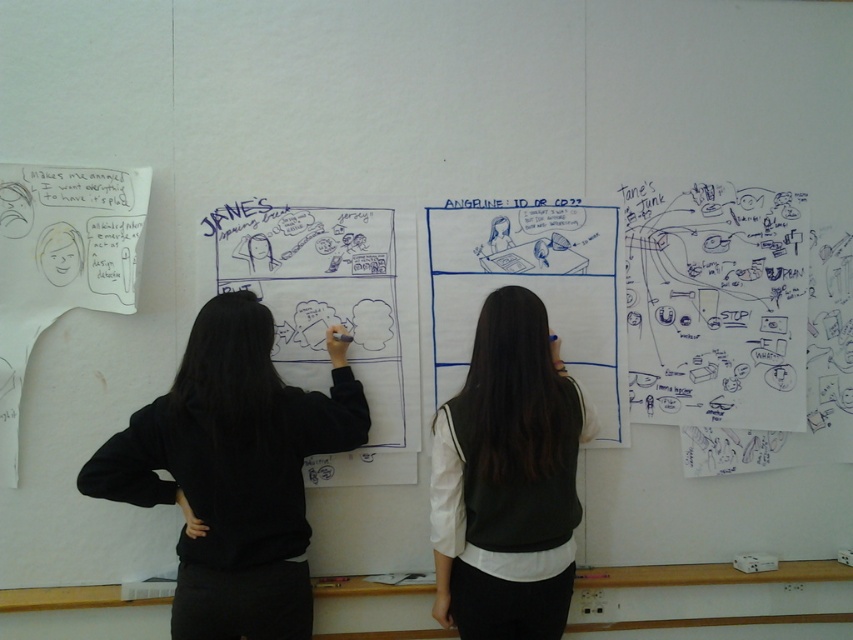
What do you see at coordinates (233, 472) in the screenshot? I see `black matte jacket at left` at bounding box center [233, 472].

Is black matte jacket at left positioned at the back of white matte vest at center?

No, it is in front of white matte vest at center.

Find the location of a particular element. This screenshot has width=853, height=640. black matte jacket at left is located at coordinates (233, 472).

I want to click on black matte jacket at left, so click(233, 472).